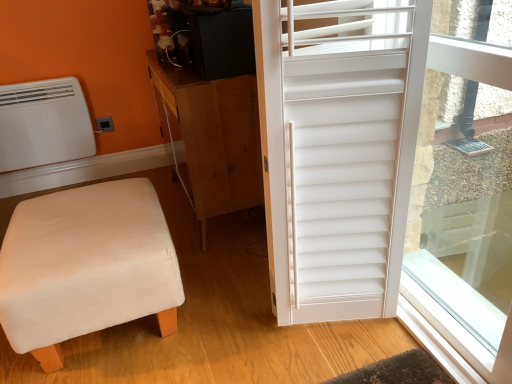
This screenshot has width=512, height=384. In order to click on vacant area that lies to the right of beige fabric stool at lower left in this screenshot , I will do `click(222, 305)`.